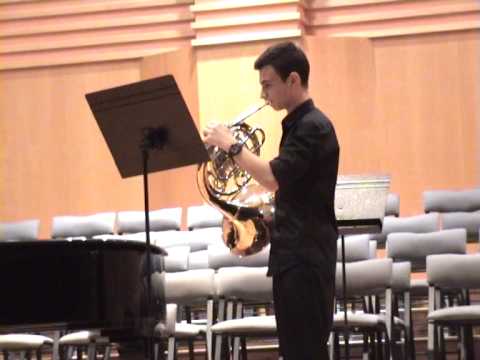
Find the location of a particular element. The image size is (480, 360). grey chair is located at coordinates (408, 249).